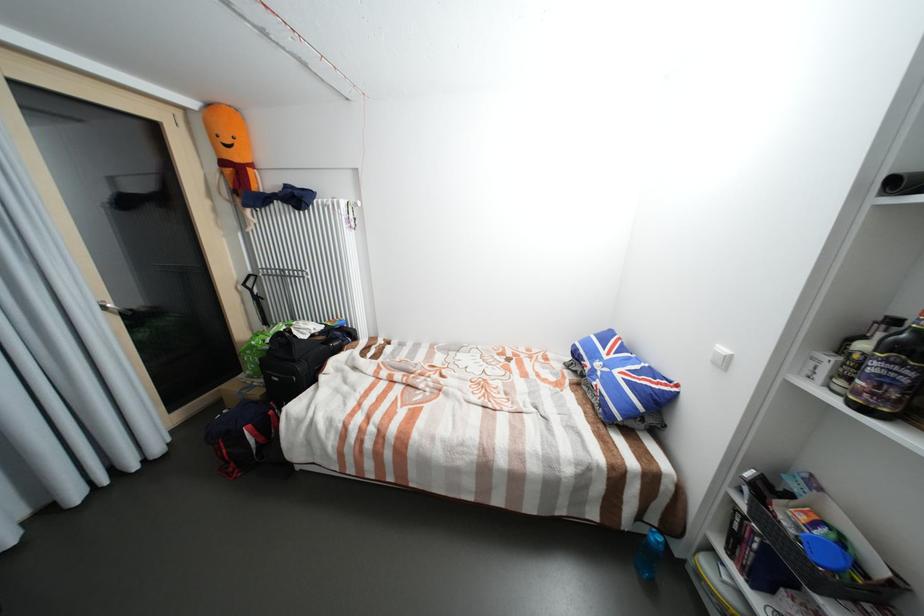
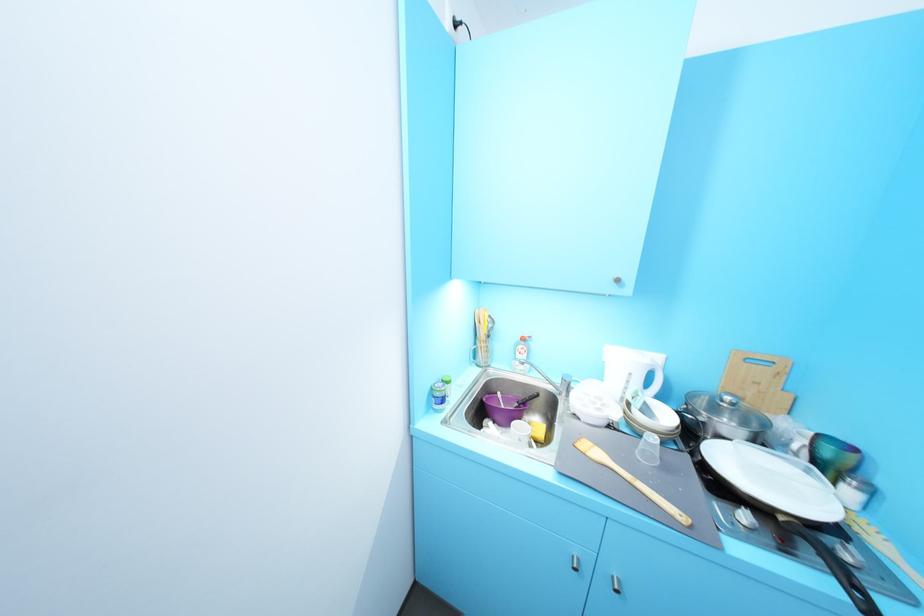
Question: I am providing you with two images of the same scene from different viewpoints. Which of the following objects are not visible in image2?

Choices:
 (A) colorful bowl
 (B) plastic cup
 (C) nightstand drawer edge
 (D) orange plush toy

Answer: (D)